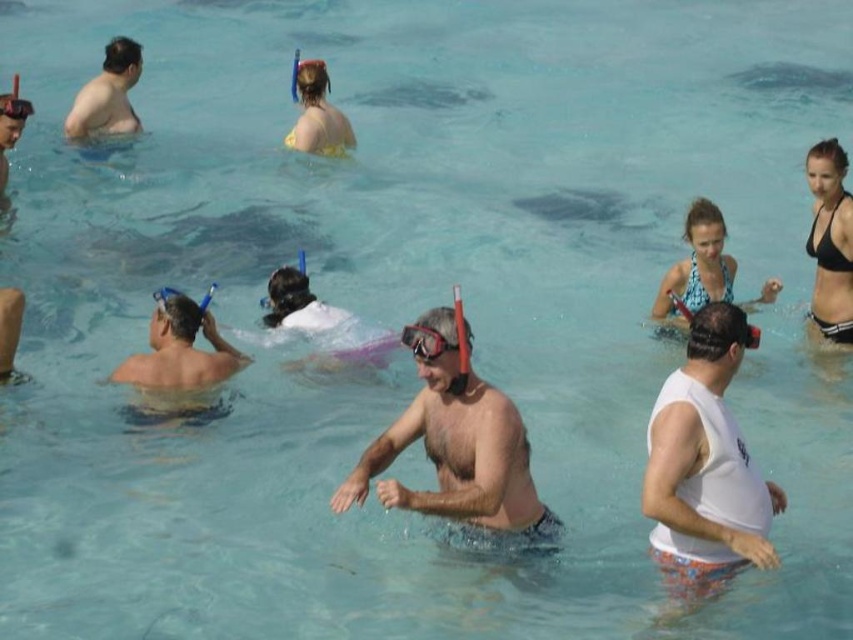
Question: Which point appears closest to the camera in this image?

Choices:
 (A) (318, 102)
 (B) (178, 358)
 (C) (431, 346)

Answer: (C)

Question: Which is farther from the clear plastic goggles at upper left?

Choices:
 (A) transparent plastic goggles at upper center
 (B) printed fabric swimsuit at right
 (C) matte skin at upper left

Answer: (C)

Question: Is the position of smooth skin man at left more distant than that of printed fabric swimsuit at right?

Choices:
 (A) yes
 (B) no

Answer: (B)

Question: Observing the image, what is the correct spatial positioning of smooth skin man at center in reference to clear plastic goggles at upper left?

Choices:
 (A) above
 (B) below

Answer: (B)

Question: Is printed fabric swimsuit at right positioned before yellow fabric snorkel at upper center?

Choices:
 (A) no
 (B) yes

Answer: (B)

Question: Which object is farther from the camera taking this photo?

Choices:
 (A) transparent rubber goggles at center
 (B) black bikini at right
 (C) matte skin at upper left
 (D) smooth skin man at center

Answer: (C)